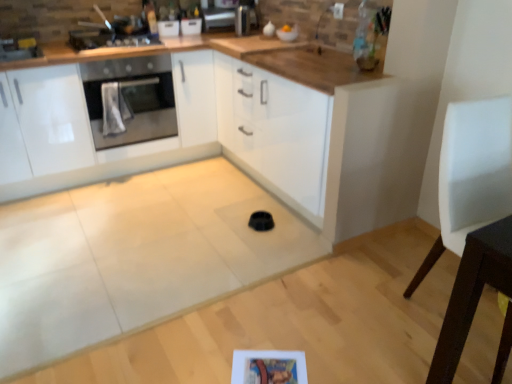
The width and height of the screenshot is (512, 384). What do you see at coordinates (471, 175) in the screenshot? I see `white leather chair at right` at bounding box center [471, 175].

Describe the element at coordinates (109, 39) in the screenshot. I see `metallic stainless steel oven at upper left` at that location.

Find the location of `stainless steel oven at left`. stainless steel oven at left is located at coordinates (130, 100).

Can stainless steel oven at left be found inside white glossy cabinets at center?

Absolutely, stainless steel oven at left is inside white glossy cabinets at center.

Looking at their sizes, would you say white glossy cabinets at center is wider or thinner than stainless steel oven at left?

In the image, white glossy cabinets at center appears to be wider than stainless steel oven at left.

How many degrees apart are the facing directions of white glossy cabinets at center and stainless steel oven at left?

2.05 degrees separate the facing orientations of white glossy cabinets at center and stainless steel oven at left.

Is point (6, 178) positioned behind point (99, 116)?

No, it is in front of (99, 116).

I want to click on cabinetry in front of the metallic stainless steel oven at upper left, so click(x=90, y=129).

From the image's perspective, does white glossy cabinets at center appear lower than metallic stainless steel oven at upper left?

Indeed, from the image's perspective, white glossy cabinets at center is shown beneath metallic stainless steel oven at upper left.

Is metallic stainless steel oven at upper left a part of white glossy cabinets at center?

Yes, white glossy cabinets at center is surrounding metallic stainless steel oven at upper left.

What's the angular difference between white glossy cabinets at center and metallic stainless steel oven at upper left's facing directions?

The angle between the facing direction of white glossy cabinets at center and the facing direction of metallic stainless steel oven at upper left is 2.05 degrees.

Can you tell me how much stainless steel oven at left and white glossy cabinets at center differ in facing direction?

stainless steel oven at left and white glossy cabinets at center are facing 2.05 degrees away from each other.

Is stainless steel oven at left spatially inside white glossy cabinets at center, or outside of it?

stainless steel oven at left fits inside white glossy cabinets at center.

Looking at this image, who is taller, stainless steel oven at left or white glossy cabinets at center?

white glossy cabinets at center.

Does stainless steel oven at left appear on the left side of white glossy cabinets at center?

Indeed, stainless steel oven at left is positioned on the left side of white glossy cabinets at center.

Considering the points (446, 163) and (238, 17), which point is in front, point (446, 163) or point (238, 17)?

Point (446, 163)

Does white leather chair at right have a greater width compared to satin silver toaster at upper center?

Correct, the width of white leather chair at right exceeds that of satin silver toaster at upper center.

Is white leather chair at right positioned far away from satin silver toaster at upper center?

Yes.

From a real-world perspective, who is located lower, white leather chair at right or satin silver toaster at upper center?

white leather chair at right, from a real-world perspective.

Based on the photo, is white glossy cabinets at center inside the boundaries of satin silver toaster at upper center, or outside?

white glossy cabinets at center is not enclosed by satin silver toaster at upper center.

Can you confirm if white glossy cabinets at center is taller than satin silver toaster at upper center?

Correct, white glossy cabinets at center is much taller as satin silver toaster at upper center.

Which point is more distant from viewer, [198,132] or [238,34]?

Positioned behind is point [198,132].

Which object is further away from the camera taking this photo, satin silver toaster at upper center or white glossy cabinets at center?

satin silver toaster at upper center is behind.

Is satin silver toaster at upper center taller than white glossy cabinets at center?

Incorrect, the height of satin silver toaster at upper center is not larger of that of white glossy cabinets at center.

Locate an element on the screen. The height and width of the screenshot is (384, 512). cabinetry beneath the satin silver toaster at upper center (from a real-world perspective) is located at coordinates (90, 129).

In terms of width, does satin silver toaster at upper center look wider or thinner when compared to white glossy cabinets at center?

In the image, satin silver toaster at upper center appears to be more narrow than white glossy cabinets at center.

Considering the relative sizes of metallic stainless steel oven at upper left and satin silver toaster at upper center in the image provided, is metallic stainless steel oven at upper left taller than satin silver toaster at upper center?

No.

In terms of size, does metallic stainless steel oven at upper left appear bigger or smaller than satin silver toaster at upper center?

metallic stainless steel oven at upper left is bigger than satin silver toaster at upper center.

This screenshot has height=384, width=512. Find the location of `appliance located above the metallic stainless steel oven at upper left (from the image's perspective)`. appliance located above the metallic stainless steel oven at upper left (from the image's perspective) is located at coordinates (242, 20).

At what (x,y) coordinates should I click in order to perform the action: click on cabinetry that is on the right side of stainless steel oven at left. Please return your answer as a coordinate pair (x, y). Looking at the image, I should click on (90, 129).

I want to click on kitchen appliance above the white glossy cabinets at center (from the image's perspective), so click(109, 39).

Based on their spatial positions, is white leather chair at right or satin silver toaster at upper center closer to white glossy cabinets at center?

The object closer to white glossy cabinets at center is satin silver toaster at upper center.

Which object lies nearer to the anchor point white leather chair at right, metallic stainless steel oven at upper left or stainless steel oven at left?

stainless steel oven at left is positioned closer to the anchor white leather chair at right.

Estimate the real-world distances between objects in this image. Which object is further from stainless steel oven at left, white glossy cabinets at center or metallic stainless steel oven at upper left?

metallic stainless steel oven at upper left lies further to stainless steel oven at left than the other object.

When comparing their distances from white glossy cabinets at center, does stainless steel oven at left or metallic stainless steel oven at upper left seem closer?

stainless steel oven at left is positioned closer to the anchor white glossy cabinets at center.

Based on their spatial positions, is white leather chair at right or satin silver toaster at upper center further from metallic stainless steel oven at upper left?

The object further to metallic stainless steel oven at upper left is white leather chair at right.

Considering their positions, is stainless steel oven at left positioned closer to satin silver toaster at upper center than white glossy cabinets at center?

stainless steel oven at left is closer to satin silver toaster at upper center.

Considering their positions, is white glossy cabinets at center positioned further to satin silver toaster at upper center than white leather chair at right?

white leather chair at right.

Looking at the image, which one is located closer to metallic stainless steel oven at upper left, white leather chair at right or stainless steel oven at left?

stainless steel oven at left is closer to metallic stainless steel oven at upper left.

Locate an element on the screen. The height and width of the screenshot is (384, 512). home appliance between metallic stainless steel oven at upper left and white glossy cabinets at center in the up-down direction is located at coordinates (130, 100).

The width and height of the screenshot is (512, 384). Find the location of `home appliance between metallic stainless steel oven at upper left and satin silver toaster at upper center from left to right`. home appliance between metallic stainless steel oven at upper left and satin silver toaster at upper center from left to right is located at coordinates (130, 100).

Identify the location of cabinetry located between stainless steel oven at left and white leather chair at right in the left-right direction. (90, 129).

This screenshot has height=384, width=512. Identify the location of appliance located between metallic stainless steel oven at upper left and white leather chair at right in the left-right direction. (242, 20).